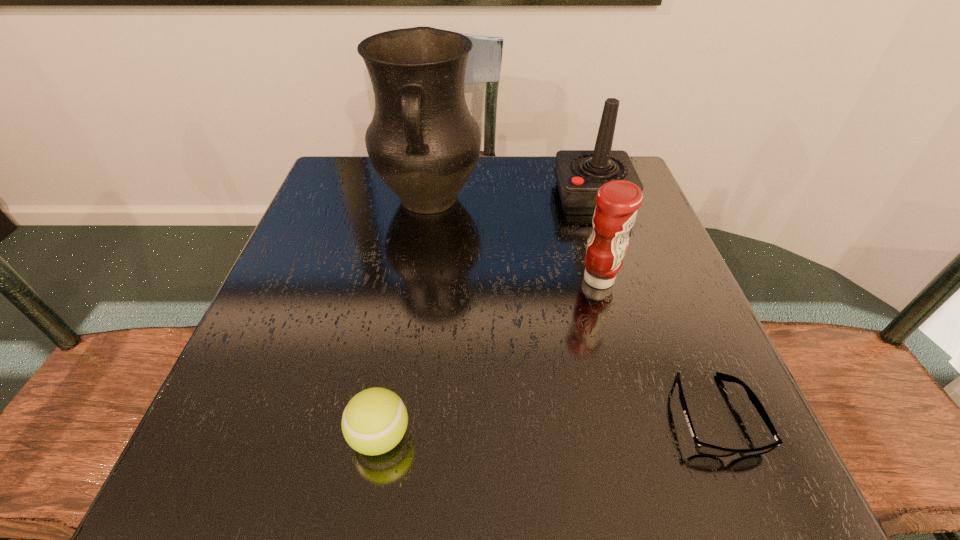
In order to click on object positioned at the far left corner in this screenshot , I will do `click(423, 142)`.

You are a GUI agent. You are given a task and a screenshot of the screen. Output one action in this format:
    pyautogui.click(x=<x>, y=<y>)
    Task: Click on the object present at the far right corner
    This screenshot has width=960, height=540.
    Given the screenshot: What is the action you would take?
    [579, 174]

Locate an element on the screen. object at the near right corner is located at coordinates (702, 448).

The height and width of the screenshot is (540, 960). In the image, there is a desktop. What are the coordinates of `vacant space at the far edge` in the screenshot? It's located at (536, 205).

The height and width of the screenshot is (540, 960). In order to click on vacant point at the near edge in this screenshot , I will do `click(372, 488)`.

In the image, there is a desktop. What are the coordinates of `vacant space at the left edge` in the screenshot? It's located at (266, 346).

At what (x,y) coordinates should I click in order to perform the action: click on free space at the right edge of the desktop. Please return your answer as a coordinate pair (x, y). This screenshot has width=960, height=540. Looking at the image, I should click on (640, 223).

You are a GUI agent. You are given a task and a screenshot of the screen. Output one action in this format:
    pyautogui.click(x=<x>, y=<y>)
    Task: Click on the blank space at the far left corner
    
    Given the screenshot: What is the action you would take?
    pyautogui.click(x=363, y=185)

Locate an element on the screen. free spot at the near left corner of the desktop is located at coordinates (235, 475).

The width and height of the screenshot is (960, 540). Identify the location of free spot at the near right corner of the desktop. (709, 482).